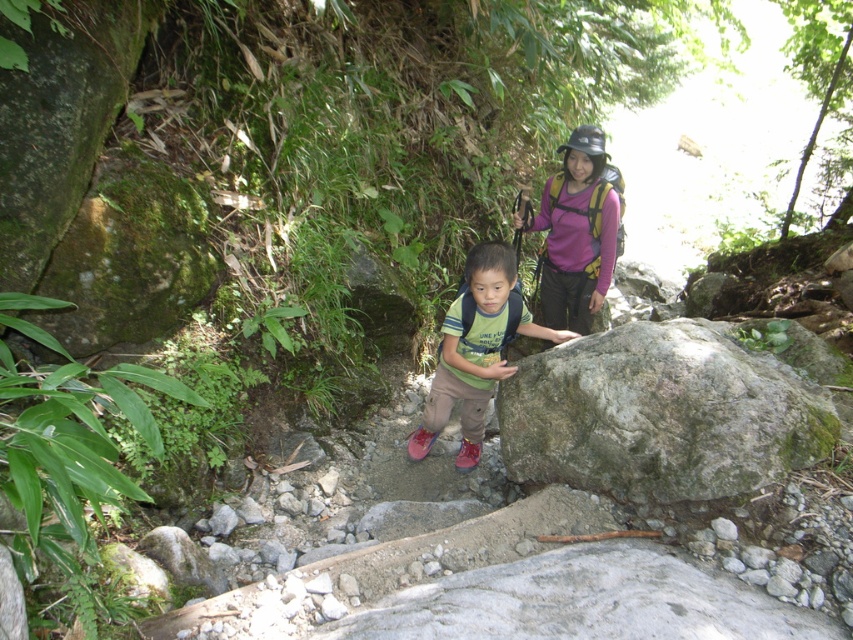
You are a hiker carrying a purple fabric backpack at upper center and need to cross a rocky path. There is a green mossy rock at center blocking your way. Can you step over it without needing to remove the backpack?

The green mossy rock at center is larger in size than the purple fabric backpack at upper center. Since the rock is bigger, it might be difficult to step over it easily while carrying the backpack. You may need to find an alternative path or carefully navigate around the rock to avoid obstacles.

You are a hiker wearing the green matte shirt at center. You notice a large rock in front of you. Which direction should you move to go around the green mossy rock at center?

Since the green mossy rock at center is to the right of the green matte shirt at center, you should move to the left to go around it.

You are a hiker trying to navigate the rocky path in the image. You see two points marked on the trail. Which point is closer to you, the hiker, as you look at the trail? The points are labeled as point [734,464] and point [488,330].

Point [734,464] is closer to the camera than point [488,330], so the hiker would see point [734,464] as closer.